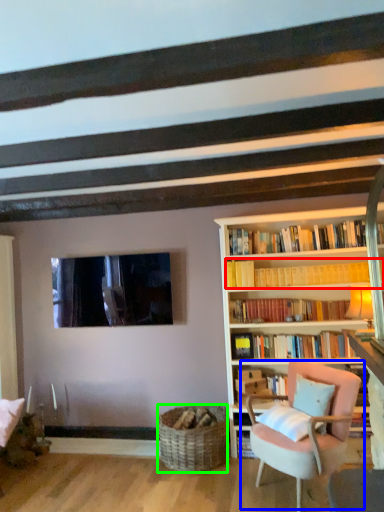
Question: Which object is positioned closest to book (highlighted by a red box)? Select from chair (highlighted by a blue box) and basket (highlighted by a green box).

Choices:
 (A) chair
 (B) basket

Answer: (A)